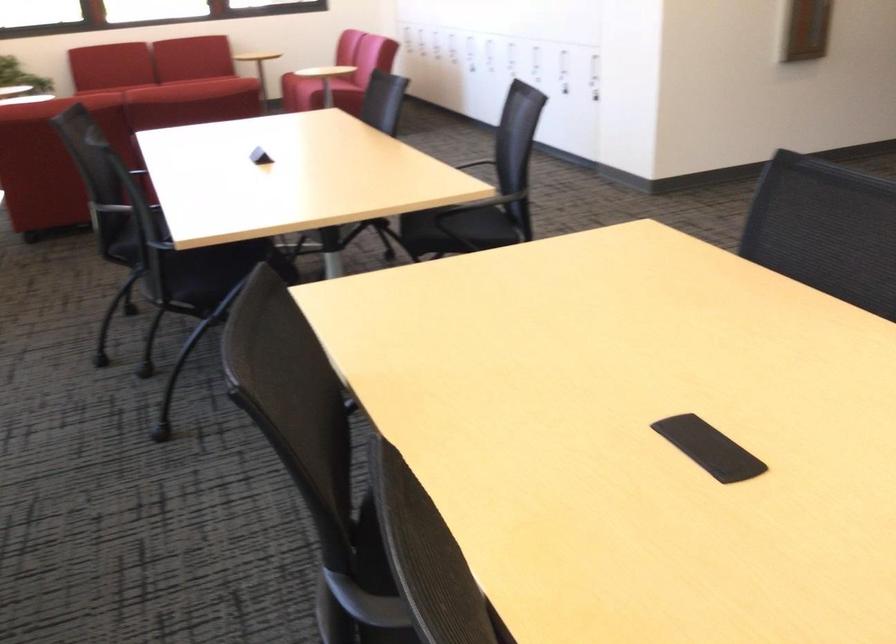
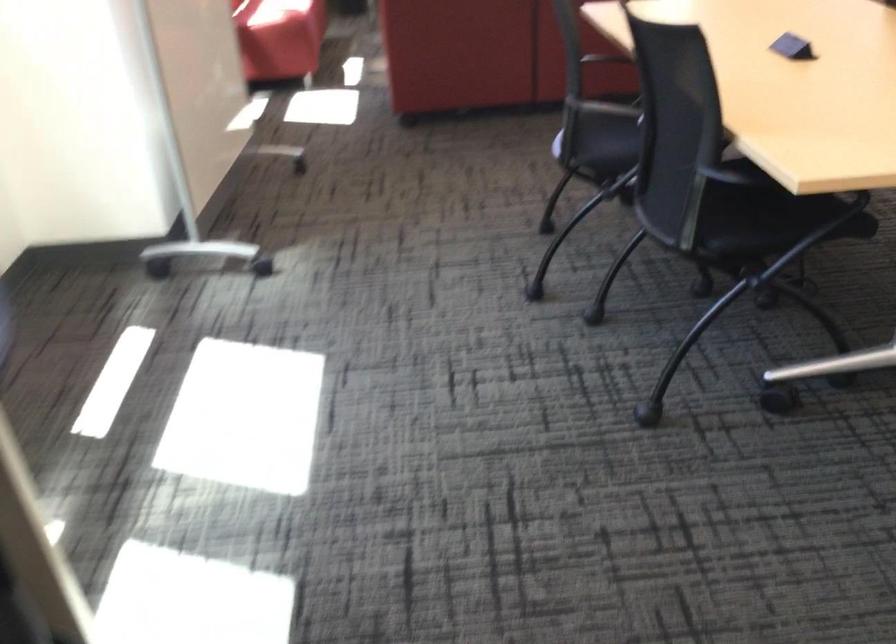
The images are taken continuously from a first-person perspective. In which direction are you moving?

The movement direction of the cameraman is left, forward.